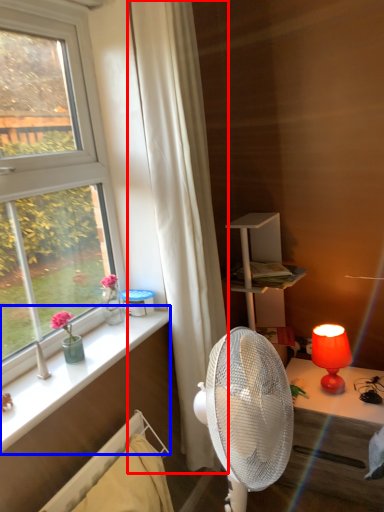
Question: Among these objects, which one is farthest to the camera, curtain (highlighted by a red box) or window sill (highlighted by a blue box)?

Choices:
 (A) curtain
 (B) window sill

Answer: (A)